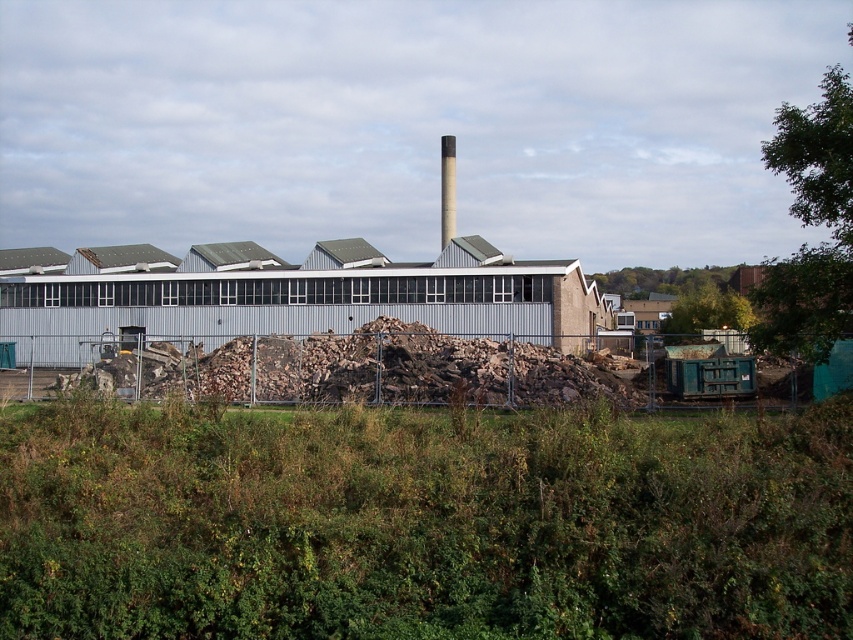
Is point (258, 392) farther from viewer compared to point (445, 138)?

That is False.

Does brown rough wood at center have a larger size compared to smooth gray chimney at center?

No.

The width and height of the screenshot is (853, 640). What are the coordinates of `brown rough wood at center` in the screenshot? It's located at (358, 369).

Is point (198, 296) in front of point (508, 346)?

No, (198, 296) is further to viewer.

Does metallic gray building at center appear over brown rough wood at center?

Indeed, metallic gray building at center is positioned over brown rough wood at center.

In order to click on metallic gray building at center in this screenshot , I will do `click(283, 294)`.

This screenshot has height=640, width=853. I want to click on metallic gray building at center, so click(x=283, y=294).

Can you confirm if metallic gray building at center is positioned to the right of smooth gray chimney at center?

No, metallic gray building at center is not to the right of smooth gray chimney at center.

Which is more to the right, metallic gray building at center or smooth gray chimney at center?

Positioned to the right is smooth gray chimney at center.

Does point (537, 304) come behind point (442, 221)?

No, it is in front of (442, 221).

Identify the location of metallic gray building at center. (283, 294).